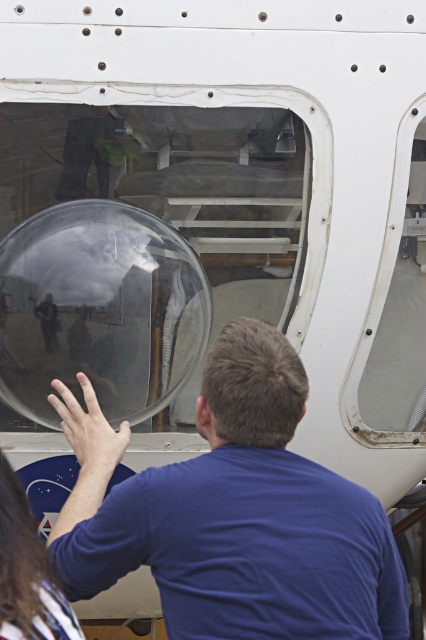
Is transparent glass bubble at center behind long brown hair at lower left?

Yes, it is.

Can you confirm if transparent glass bubble at center is smaller than long brown hair at lower left?

Actually, transparent glass bubble at center might be larger than long brown hair at lower left.

Between point (193, 352) and point (14, 532), which one is positioned in front?

Point (14, 532) is more forward.

Locate an element on the screen. This screenshot has width=426, height=640. transparent glass bubble at center is located at coordinates (100, 308).

Does blue matte shirt at center have a lesser width compared to long brown hair at lower left?

No.

Locate an element on the screen. The height and width of the screenshot is (640, 426). blue matte shirt at center is located at coordinates (233, 513).

Is blue matte shirt at center wider than transparent glass bubble at center?

Correct, the width of blue matte shirt at center exceeds that of transparent glass bubble at center.

Which is in front, point (222, 330) or point (170, 336)?

Positioned in front is point (222, 330).

What are the coordinates of `blue matte shirt at center` in the screenshot? It's located at (233, 513).